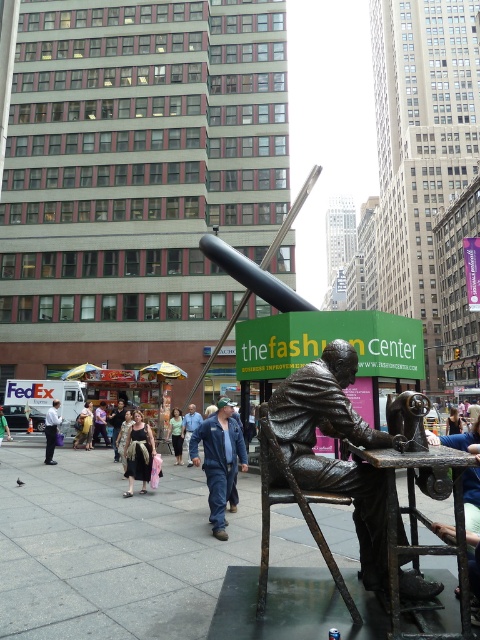
Question: Does matte black dress at center appear on the left side of dark brown leather jacket at center?

Choices:
 (A) no
 (B) yes

Answer: (A)

Question: Is blue denim jacket at center wider than denim jacket at center?

Choices:
 (A) no
 (B) yes

Answer: (B)

Question: Estimate the real-world distances between objects in this image. Which object is closer to the blue denim jacket at center?

Choices:
 (A) denim jacket at center
 (B) blue jeans at center

Answer: (B)

Question: Which is farther from the bronze statue at center?

Choices:
 (A) dark blue jeans at center
 (B) dark brown leather jacket at center
 (C) bronze textured chair at center
 (D) denim jacket at lower left

Answer: (B)

Question: Which point is farther to the camera?

Choices:
 (A) (79, 420)
 (B) (303, 508)

Answer: (A)

Question: Is matte black dress at center thinner than blue jeans at center?

Choices:
 (A) yes
 (B) no

Answer: (A)